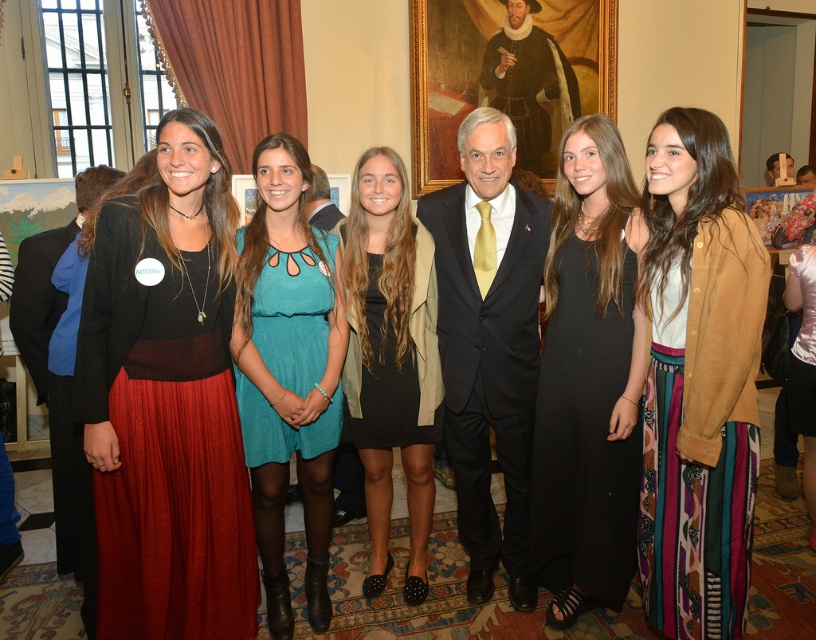
Question: Is matte black top at center smaller than black suit at center?

Choices:
 (A) yes
 (B) no

Answer: (A)

Question: Among these points, which one is farthest from the camera?

Choices:
 (A) (428, 442)
 (B) (557, 356)
 (C) (667, 289)
 (D) (491, 150)

Answer: (A)

Question: Is matte black top at center to the left of black suit at center from the viewer's perspective?

Choices:
 (A) no
 (B) yes

Answer: (B)

Question: Does black suit at center have a greater width compared to black matte dress at center?

Choices:
 (A) yes
 (B) no

Answer: (A)

Question: Which point appears farthest from the camera in this image?

Choices:
 (A) (646, 182)
 (B) (493, 332)
 (C) (220, 396)
 (D) (268, 532)

Answer: (D)

Question: Which point appears closest to the camera in this image?

Choices:
 (A) (544, 289)
 (B) (295, 348)
 (C) (189, 579)

Answer: (C)